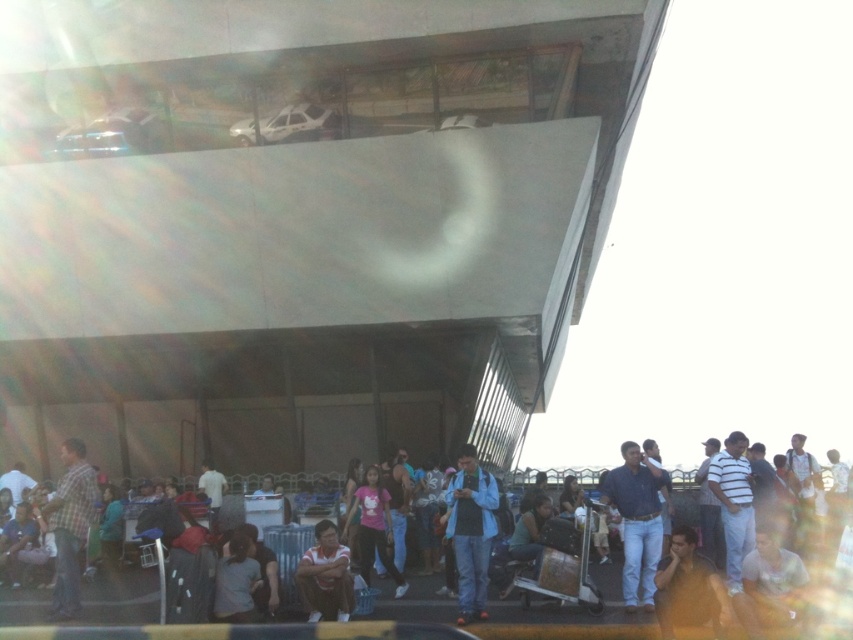
You are a photographer standing in the crowd at the transportation hub. You want to take a photo that includes both the blue denim jacket at center and the plaid fabric shirt at lower left. Which of the two items should you focus on first to ensure both are in clear view?

The blue denim jacket at center is closer to the viewer than the plaid fabric shirt at lower left. To ensure both are in clear view, focus on the blue denim jacket at center first since it is closer, and the depth of field will likely keep the plaid fabric shirt at lower left in focus as well.

You are standing at the public transportation hub and want to take a photo of the two points mentioned. Which point, point (693, 531) or point (741, 504), will appear larger in your camera view?

Point (693, 531) is closer to the camera than point (741, 504), so it will appear larger in the camera view.

You are standing at the transportation hub and see the dark blue jeans at lower center and the striped cotton shirt at right. Which clothing item is closer to you?

The dark blue jeans at lower center is closer to you because it is in front of the striped cotton shirt at right.